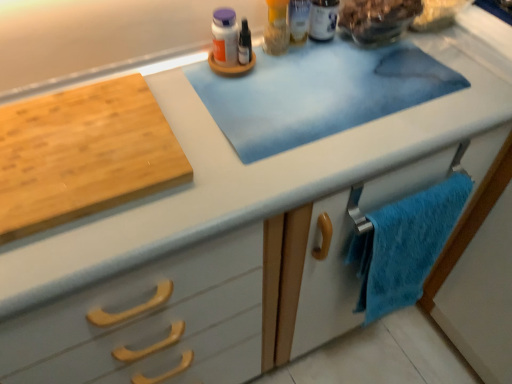
Question: Does natural wood cutting board at left appear on the left side of white plastic bottle at upper center, marked as the 1th toiletry in a right-to-left arrangement?

Choices:
 (A) no
 (B) yes

Answer: (B)

Question: From the image's perspective, is natural wood cutting board at left on white plastic bottle at upper center, marked as the 1th toiletry in a right-to-left arrangement?

Choices:
 (A) no
 (B) yes

Answer: (A)

Question: Is natural wood cutting board at left shorter than white plastic bottle at upper center, which appears as the 2th toiletry when viewed from the left?

Choices:
 (A) yes
 (B) no

Answer: (A)

Question: Is natural wood cutting board at left surrounding white plastic bottle at upper center, which appears as the 2th toiletry when viewed from the left?

Choices:
 (A) yes
 (B) no

Answer: (B)

Question: From the image's perspective, would you say natural wood cutting board at left is shown under white plastic bottle at upper center, marked as the 1th toiletry in a right-to-left arrangement?

Choices:
 (A) yes
 (B) no

Answer: (A)

Question: Does natural wood cutting board at left have a greater width compared to white plastic bottle at upper center, which appears as the 2th toiletry when viewed from the left?

Choices:
 (A) yes
 (B) no

Answer: (A)

Question: Is white plastic bottle at upper center, marked as the 1th toiletry in a right-to-left arrangement, aimed at natural wood cutting board at left?

Choices:
 (A) yes
 (B) no

Answer: (B)

Question: Is white plastic bottle at upper center, marked as the 1th toiletry in a right-to-left arrangement, smaller than natural wood cutting board at left?

Choices:
 (A) no
 (B) yes

Answer: (B)

Question: Is natural wood cutting board at left at the back of white plastic bottle at upper center, which appears as the 2th toiletry when viewed from the left?

Choices:
 (A) yes
 (B) no

Answer: (B)

Question: Can you confirm if white plastic bottle at upper center, which appears as the 2th toiletry when viewed from the left, is positioned to the left of natural wood cutting board at left?

Choices:
 (A) yes
 (B) no

Answer: (B)

Question: From the image's perspective, is white plastic bottle at upper center, which appears as the 2th toiletry when viewed from the left, beneath natural wood cutting board at left?

Choices:
 (A) no
 (B) yes

Answer: (A)

Question: Can you confirm if white plastic bottle at upper center, which appears as the 2th toiletry when viewed from the left, is wider than natural wood cutting board at left?

Choices:
 (A) no
 (B) yes

Answer: (A)

Question: Could you tell me if blue fuzzy towel at lower right is facing white plastic bottle at upper center, marked as the 1th toiletry in a right-to-left arrangement?

Choices:
 (A) no
 (B) yes

Answer: (A)